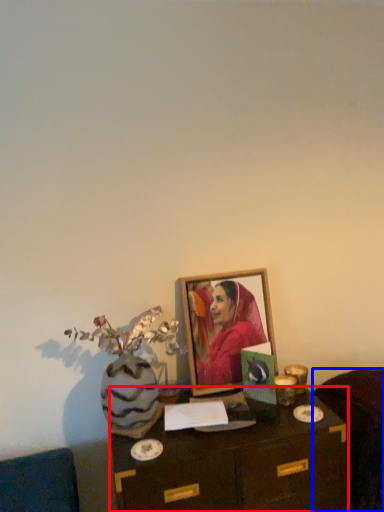
Question: Which point is further to the camera, table (highlighted by a red box) or furniture (highlighted by a blue box)?

Choices:
 (A) table
 (B) furniture

Answer: (B)